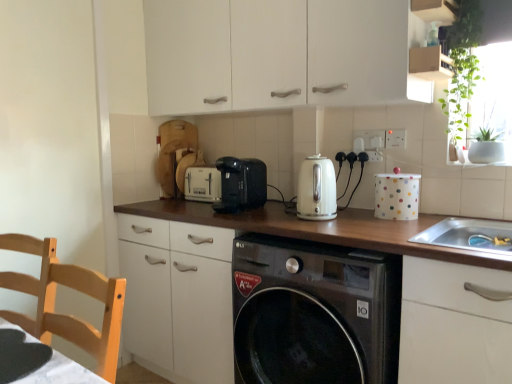
Question: Is light wood chair at left directly adjacent to black plastic toaster at center?

Choices:
 (A) yes
 (B) no

Answer: (B)

Question: Is light wood chair at left oriented towards black plastic toaster at center?

Choices:
 (A) yes
 (B) no

Answer: (B)

Question: Can you confirm if light wood chair at left is bigger than black plastic toaster at center?

Choices:
 (A) yes
 (B) no

Answer: (A)

Question: Is light wood chair at left taller than black plastic toaster at center?

Choices:
 (A) no
 (B) yes

Answer: (B)

Question: Is light wood chair at left surrounding black plastic toaster at center?

Choices:
 (A) no
 (B) yes

Answer: (A)

Question: Considering the positions of white plastic electric outlet at upper right, the 2th electric outlet viewed from the back, and brown wood countertop at center in the image, is white plastic electric outlet at upper right, the 2th electric outlet viewed from the back, taller or shorter than brown wood countertop at center?

Choices:
 (A) tall
 (B) short

Answer: (B)

Question: From the image's perspective, is white plastic electric outlet at upper right, the 2th electric outlet viewed from the back, above or below brown wood countertop at center?

Choices:
 (A) below
 (B) above

Answer: (B)

Question: From a real-world perspective, is white plastic electric outlet at upper right, the first electric outlet in the right-to-left sequence, above or below brown wood countertop at center?

Choices:
 (A) above
 (B) below

Answer: (A)

Question: Is white plastic electric outlet at upper right, the second electric outlet when ordered from left to right, situated inside brown wood countertop at center or outside?

Choices:
 (A) inside
 (B) outside

Answer: (B)

Question: Is light wood chair at left taller or shorter than black matte table at lower left?

Choices:
 (A) tall
 (B) short

Answer: (A)

Question: In terms of width, does light wood chair at left look wider or thinner when compared to black matte table at lower left?

Choices:
 (A) wide
 (B) thin

Answer: (B)

Question: Is light wood chair at left to the left or to the right of black matte table at lower left in the image?

Choices:
 (A) right
 (B) left

Answer: (B)

Question: From a real-world perspective, relative to black matte table at lower left, is light wood chair at left vertically above or below?

Choices:
 (A) above
 (B) below

Answer: (B)

Question: Is white plastic toaster at center, which is the 2th appliance in right-to-left order, wider or thinner than green leafy plant at upper right?

Choices:
 (A) wide
 (B) thin

Answer: (A)

Question: From the image's perspective, is white plastic toaster at center, which is the 1th appliance in back-to-front order, located above or below green leafy plant at upper right?

Choices:
 (A) below
 (B) above

Answer: (A)